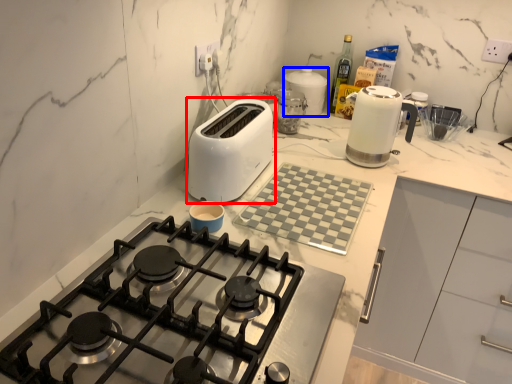
Question: Among these objects, which one is nearest to the camera, toaster (highlighted by a red box) or kitchen appliance (highlighted by a blue box)?

Choices:
 (A) toaster
 (B) kitchen appliance

Answer: (A)